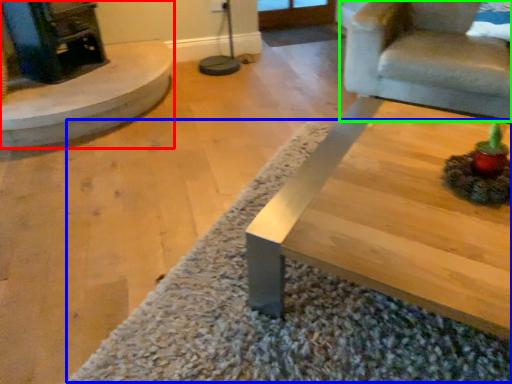
Question: Estimate the real-world distances between objects in this image. Which object is closer to fireplace (highlighted by a red box), mat (highlighted by a blue box) or chair (highlighted by a green box)?

Choices:
 (A) mat
 (B) chair

Answer: (A)